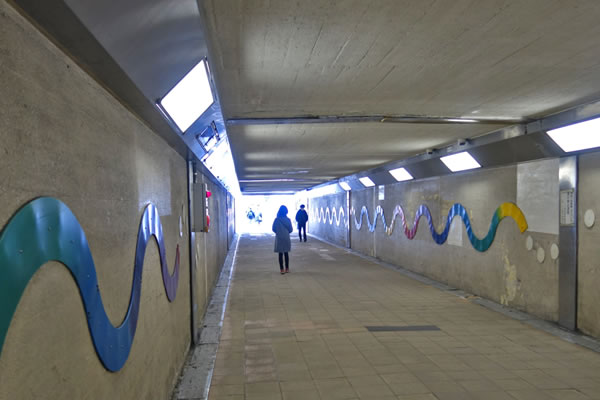
This screenshot has height=400, width=600. I want to click on ceiling, so click(x=352, y=135).